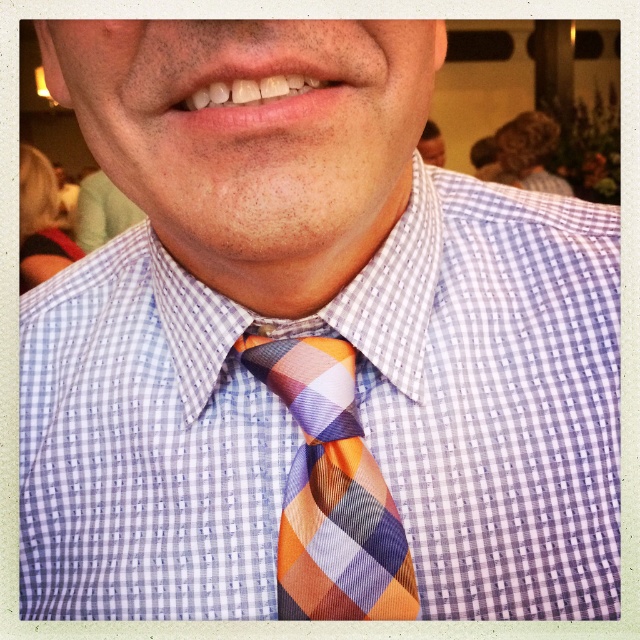
You are a photographer adjusting your camera settings to focus on the checkered fabric shirt at center. What are the exact coordinates where you should aim your camera to capture the shirt perfectly?

The exact coordinates to focus on the checkered fabric shirt at center are point (356,413).

You are standing in front of the person in the image. There are two points marked on their clothing. One is at coordinate point (573, 308) and the other at point (296, 385). Which point is closer to you?

Point (296, 385) is closer to you because point (573, 308) is behind it.

From the picture: You are a fashion stylist helping a client choose an outfit. The client wants to ensure that their checkered fabric shirt at center and plaid silk tie at center are aligned properly. Based on the image, which item should be positioned to the left when viewed from the front?

The checkered fabric shirt at center should be positioned to the left of the plaid silk tie at center because the description states that the checkered fabric shirt at center is to the left of the plaid silk tie at center.